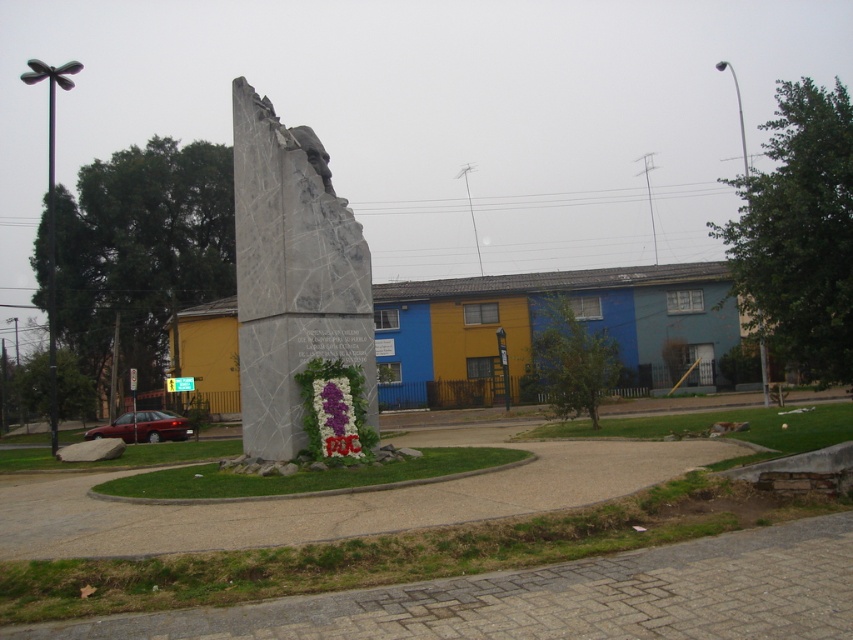
You are a visitor at the monument and want to take a photo of the gray marble statue at center and the purple fabric flower at center. If you stand facing the monument, which object will be on your left?

The gray marble statue at center is positioned on the left side of purple fabric flower at center, so when facing the monument, the gray marble statue at center will be on your left side.